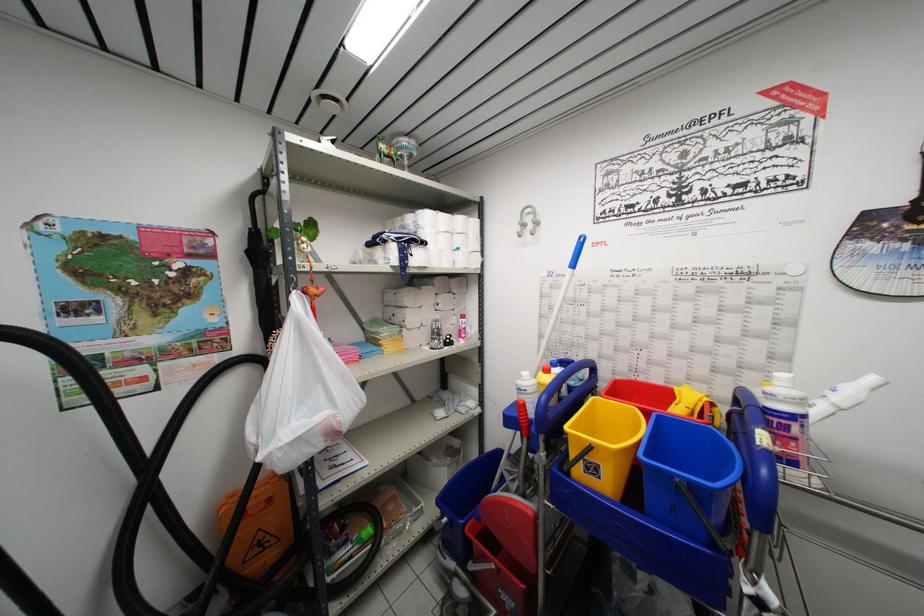
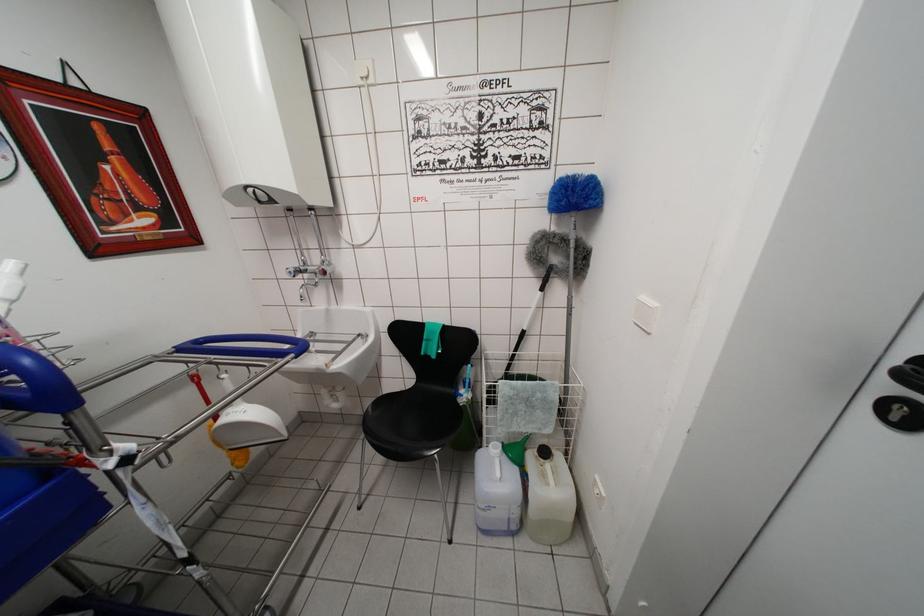
The point at (772,456) is marked in the first image. Where is the corresponding point in the second image?

(5, 349)